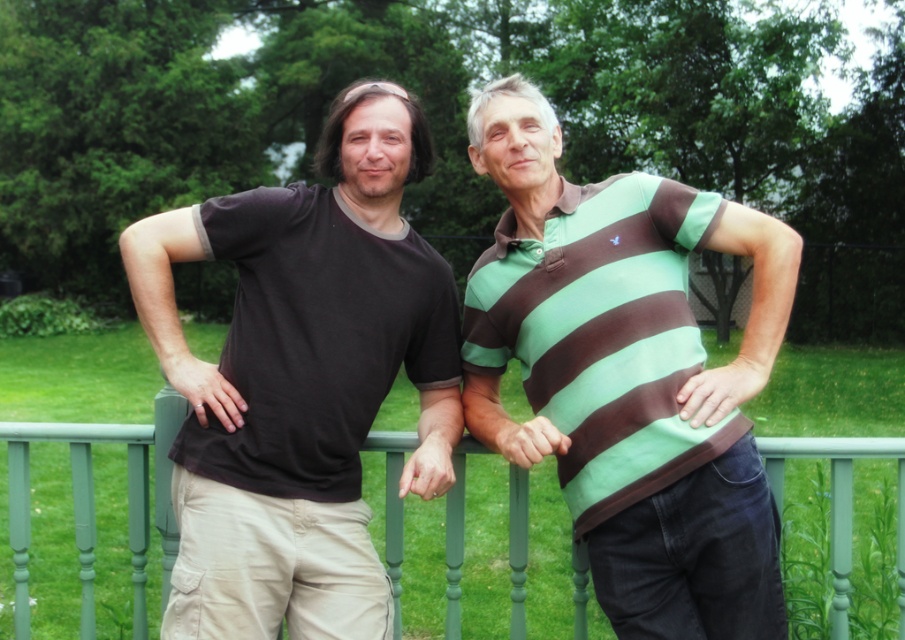
Between green striped polo shirt at center and matte brown striped polo shirt at center, which one is positioned higher?

Positioned higher is matte brown striped polo shirt at center.

Consider the image. Does green striped polo shirt at center have a smaller size compared to matte brown striped polo shirt at center?

Actually, green striped polo shirt at center might be larger than matte brown striped polo shirt at center.

Find the location of a particular element. The image size is (905, 640). green striped polo shirt at center is located at coordinates (627, 376).

This screenshot has height=640, width=905. In order to click on green striped polo shirt at center in this screenshot , I will do `click(627, 376)`.

Who is more forward, (478,113) or (539,275)?

Positioned in front is point (539,275).

Who is shorter, matte black t-shirt at center or green striped polo shirt at center?

Standing shorter between the two is green striped polo shirt at center.

At what (x,y) coordinates should I click in order to perform the action: click on matte black t-shirt at center. Please return your answer as a coordinate pair (x, y). The image size is (905, 640). Looking at the image, I should click on (621, 378).

Which is more to the left, matte black t-shirt at left or green painted wood at center?

matte black t-shirt at left is more to the left.

This screenshot has width=905, height=640. I want to click on matte black t-shirt at left, so click(302, 380).